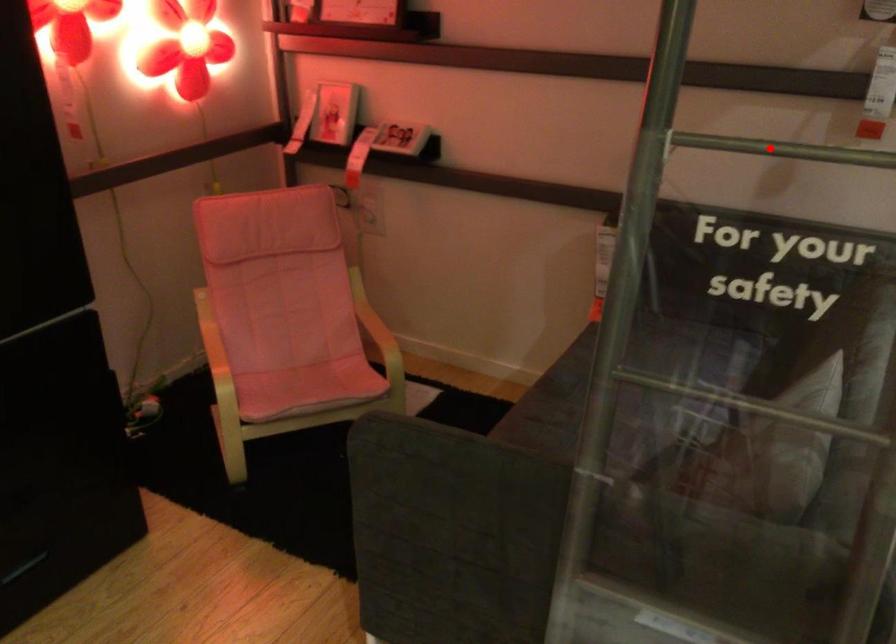
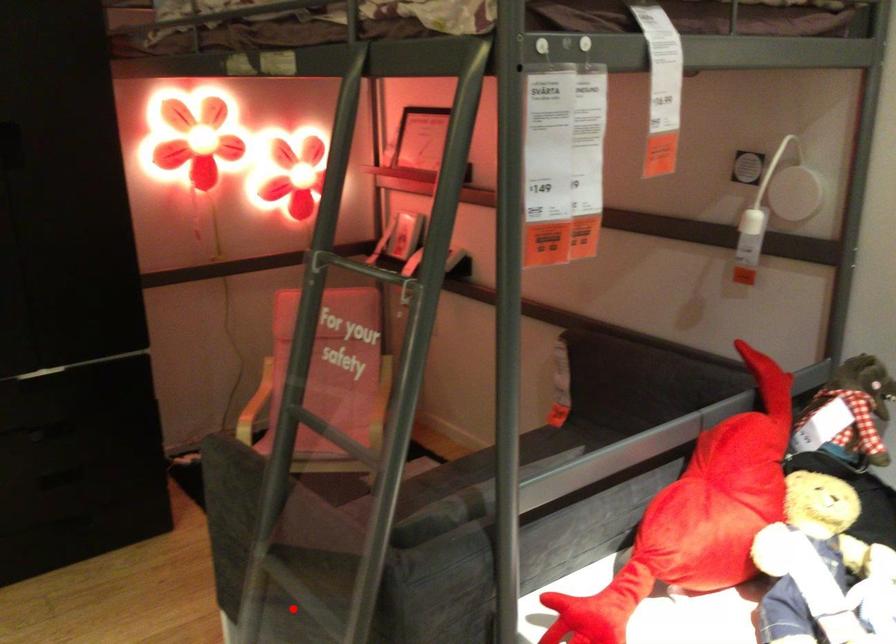
I am providing you with two images of the same scene from different viewpoints. A red point is marked on the first image and another point is marked on the second image. Is the marked point in image1 the same physical position as the marked point in image2?

No